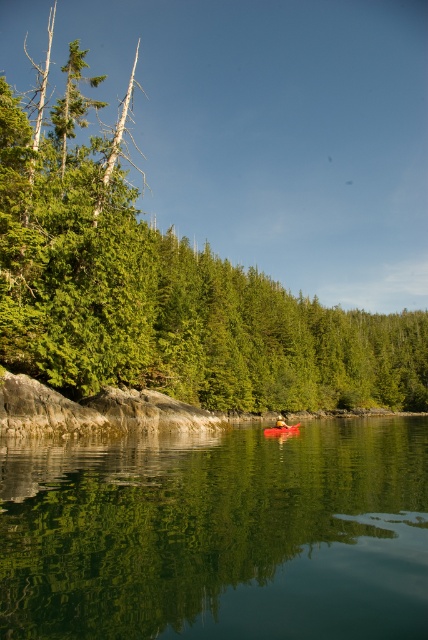
You are standing on the shore of the lake and see the matte red canoe at center and the yellow fabric person at center. Which object is closer to you?

The matte red canoe at center is closer to the viewer than the yellow fabric person at center.

You are planning to take a photo of the serene scene with the green smooth water at lower center and the yellow fabric person at center. Which object in the scene is wider?

The green smooth water at lower center is wider than the yellow fabric person at center.